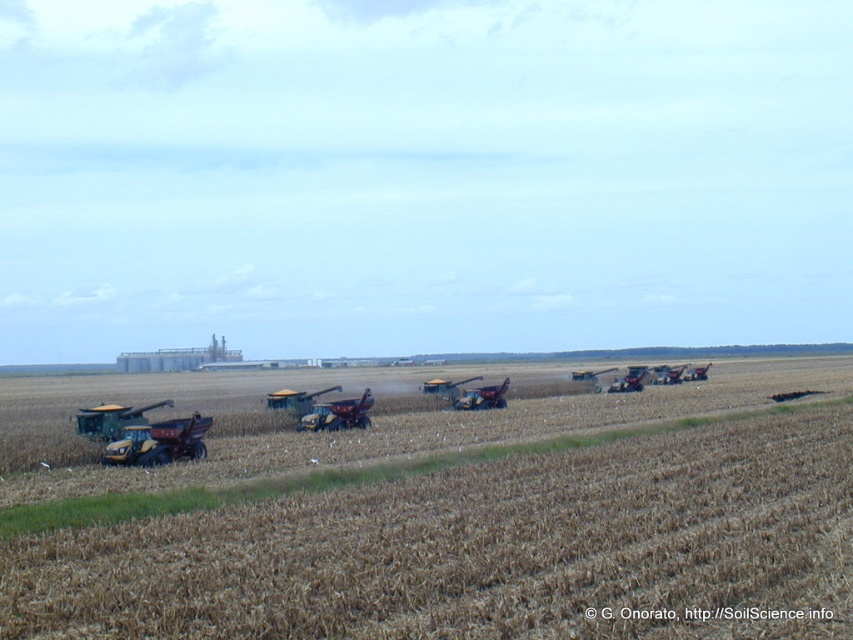
Question: Is the position of metallic red tractor at center more distant than that of metallic red tractor at center-right?

Choices:
 (A) yes
 (B) no

Answer: (B)

Question: Is yellow metallic tractor at lower left closer to the viewer compared to metallic red tractor at center?

Choices:
 (A) no
 (B) yes

Answer: (B)

Question: Estimate the real-world distances between objects in this image. Which object is farther from the metallic yellow tractor at center?

Choices:
 (A) metallic red tractor at center-right
 (B) yellow metallic tractor at lower left
 (C) yellow-green plastic tractor at lower left

Answer: (A)

Question: Does yellow metallic tractor at lower left appear over yellow-green plastic tractor at lower left?

Choices:
 (A) no
 (B) yes

Answer: (A)

Question: Which of the following is the closest to the observer?

Choices:
 (A) (474, 528)
 (B) (312, 416)
 (C) (99, 413)

Answer: (A)

Question: Which point is farther to the camera?

Choices:
 (A) metallic red tractor at center
 (B) yellow-green plastic tractor at lower left
 (C) yellow metallic tractor at lower left
 (D) brown matte wheat field at center

Answer: (A)